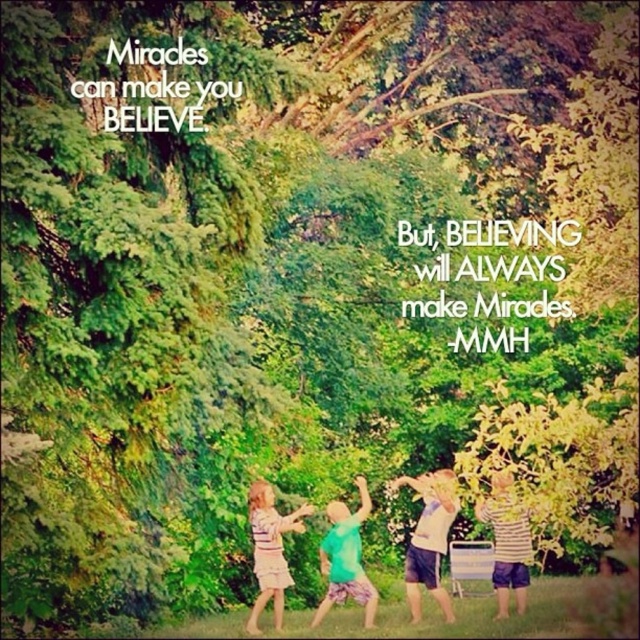
Question: Where is white cotton shirt at center located in relation to striped fabric dress at lower left in the image?

Choices:
 (A) above
 (B) below

Answer: (A)

Question: Among these points, which one is farthest from the camera?

Choices:
 (A) (444, 541)
 (B) (253, 632)
 (C) (353, 570)

Answer: (C)

Question: Estimate the real-world distances between objects in this image. Which object is closer to the white cotton shirt at center?

Choices:
 (A) striped cotton shirt at lower right
 (B) striped fabric dress at lower left
 (C) green matte shirt at center

Answer: (A)

Question: Which object is farther from the camera taking this photo?

Choices:
 (A) green matte shirt at center
 (B) striped fabric dress at lower left
 (C) white cotton shirt at center
 (D) striped cotton shirt at lower right

Answer: (B)

Question: Where is white cotton shirt at center located in relation to striped cotton shirt at lower right in the image?

Choices:
 (A) below
 (B) above

Answer: (A)

Question: Can you confirm if white cotton shirt at center is thinner than green matte shirt at center?

Choices:
 (A) yes
 (B) no

Answer: (A)